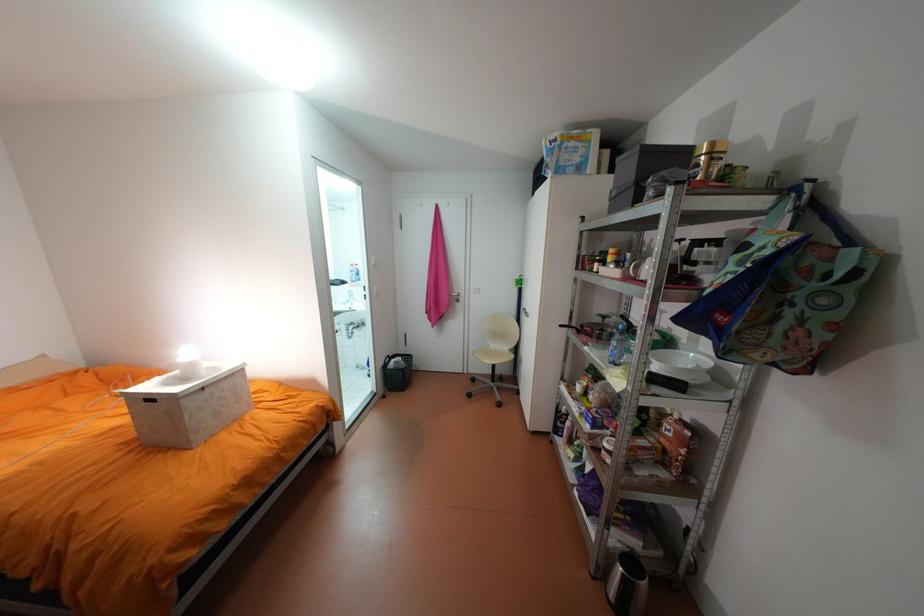
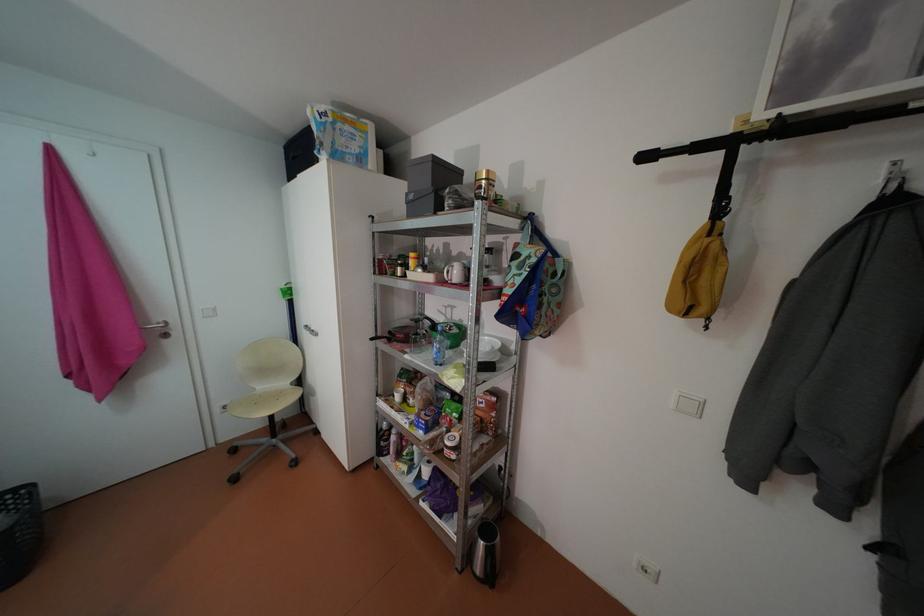
Question: How did the camera likely rotate?

Choices:
 (A) Left
 (B) Right
 (C) Up
 (D) Down

Answer: (B)